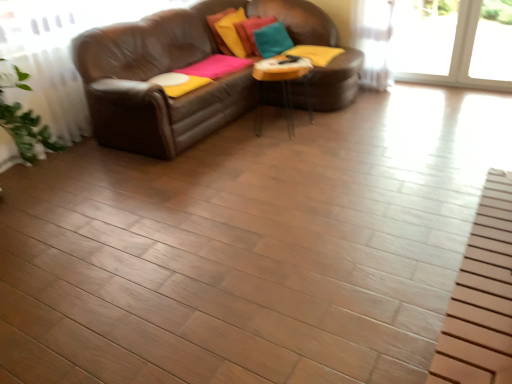
Question: Can you confirm if velvet teal pillow at upper center, the 2th pillow in the left-to-right sequence, is bigger than teal fabric pillow at upper center, the 3th pillow when ordered from left to right?

Choices:
 (A) no
 (B) yes

Answer: (B)

Question: Does velvet teal pillow at upper center, the 2th pillow in the left-to-right sequence, have a lesser width compared to teal fabric pillow at upper center, which is counted as the 1th pillow, starting from the right?

Choices:
 (A) yes
 (B) no

Answer: (A)

Question: Is velvet teal pillow at upper center, marked as the 2th pillow in a right-to-left arrangement, taller than teal fabric pillow at upper center, which is counted as the 1th pillow, starting from the right?

Choices:
 (A) yes
 (B) no

Answer: (A)

Question: From the image's perspective, is velvet teal pillow at upper center, the 2th pillow in the left-to-right sequence, located above teal fabric pillow at upper center, the 3th pillow when ordered from left to right?

Choices:
 (A) no
 (B) yes

Answer: (B)

Question: Is velvet teal pillow at upper center, marked as the 2th pillow in a right-to-left arrangement, further to the viewer compared to teal fabric pillow at upper center, which is counted as the 1th pillow, starting from the right?

Choices:
 (A) yes
 (B) no

Answer: (A)

Question: From a real-world perspective, is teal fabric pillow at upper center, the 3th pillow when ordered from left to right, positioned above or below velvet yellow pillow at upper center, marked as the 1th pillow in a left-to-right arrangement?

Choices:
 (A) above
 (B) below

Answer: (B)

Question: Considering the positions of teal fabric pillow at upper center, the 3th pillow when ordered from left to right, and velvet yellow pillow at upper center, marked as the 1th pillow in a left-to-right arrangement, in the image, is teal fabric pillow at upper center, the 3th pillow when ordered from left to right, bigger or smaller than velvet yellow pillow at upper center, marked as the 1th pillow in a left-to-right arrangement,?

Choices:
 (A) small
 (B) big

Answer: (A)

Question: Looking at their shapes, would you say teal fabric pillow at upper center, the 3th pillow when ordered from left to right, is wider or thinner than velvet yellow pillow at upper center, placed as the third pillow when sorted from right to left?

Choices:
 (A) thin
 (B) wide

Answer: (B)

Question: From the image's perspective, is teal fabric pillow at upper center, the 3th pillow when ordered from left to right, located above or below velvet yellow pillow at upper center, marked as the 1th pillow in a left-to-right arrangement?

Choices:
 (A) above
 (B) below

Answer: (B)

Question: Is point (290, 77) positioned closer to the camera than point (252, 39)?

Choices:
 (A) farther
 (B) closer

Answer: (B)

Question: Is clear glass table at center in front of or behind velvet teal pillow at upper center, marked as the 2th pillow in a right-to-left arrangement, in the image?

Choices:
 (A) front
 (B) behind

Answer: (A)

Question: From a real-world perspective, relative to velvet teal pillow at upper center, the 2th pillow in the left-to-right sequence, is clear glass table at center vertically above or below?

Choices:
 (A) above
 (B) below

Answer: (B)

Question: From the image's perspective, is clear glass table at center located above or below velvet teal pillow at upper center, marked as the 2th pillow in a right-to-left arrangement?

Choices:
 (A) above
 (B) below

Answer: (B)

Question: From the image's perspective, is velvet teal pillow at upper center, the 2th pillow in the left-to-right sequence, above or below clear glass table at center?

Choices:
 (A) above
 (B) below

Answer: (A)

Question: In terms of width, does velvet teal pillow at upper center, marked as the 2th pillow in a right-to-left arrangement, look wider or thinner when compared to clear glass table at center?

Choices:
 (A) thin
 (B) wide

Answer: (A)